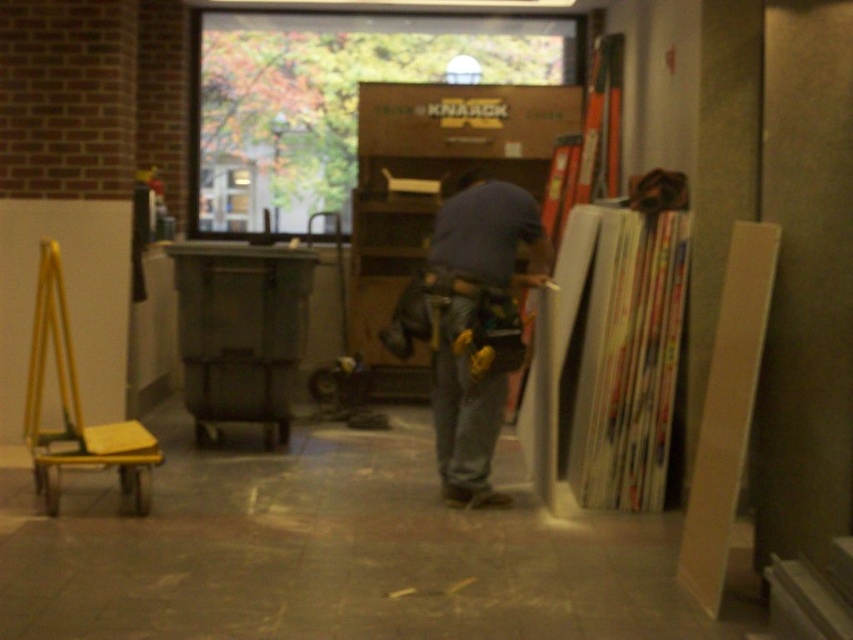
You are organizing the workspace and need to move the brown cardboard bookshelf at center and the denim at center. According to their positions, which object should you move first to clear the path towards the yellow folding chair against the left wall?

The brown cardboard bookshelf at center is positioned on the left side of denim at center. Since the bookshelf is to the left of the denim, moving the denim at center first would allow access to the bookshelf if needed, but to clear the path towards the yellow folding chair against the left wall, you should move the brown cardboard bookshelf at center first because it is closer to the chair.

You are organizing items in the workspace. You have two objects at the center of the scene, the blue denim jeans at center and the denim at center. Which one is taller?

The blue denim jeans at center is taller than the denim at center.